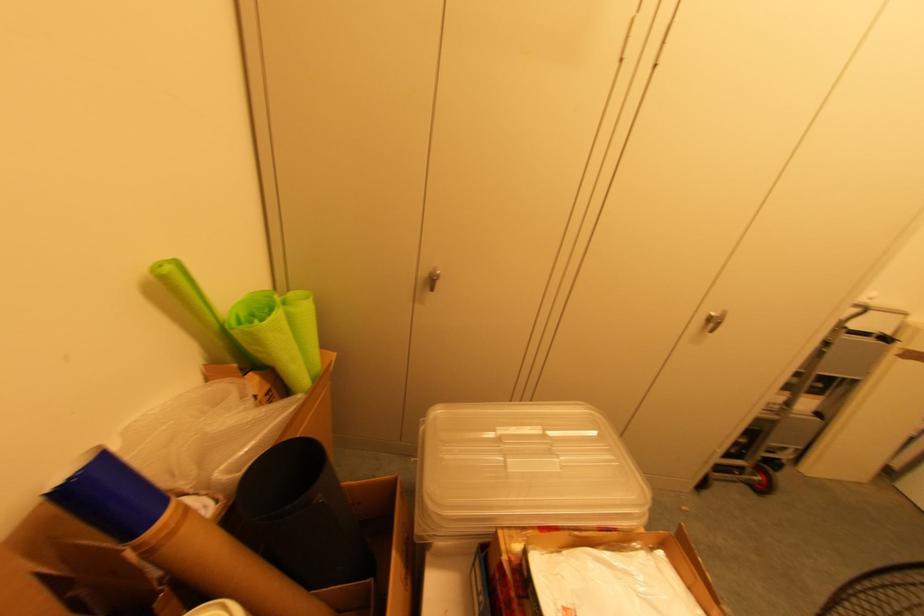
Which object does [280,334] point to?

This point indicates the rolled green material.